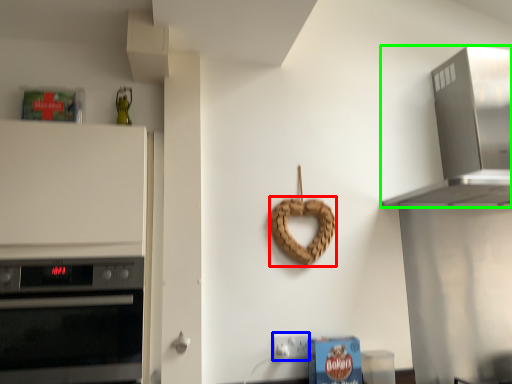
Question: Estimate the real-world distances between objects in this image. Which object is farther from pretzel (highlighted by a red box), electric outlet (highlighted by a blue box) or home appliance (highlighted by a green box)?

Choices:
 (A) electric outlet
 (B) home appliance

Answer: (B)